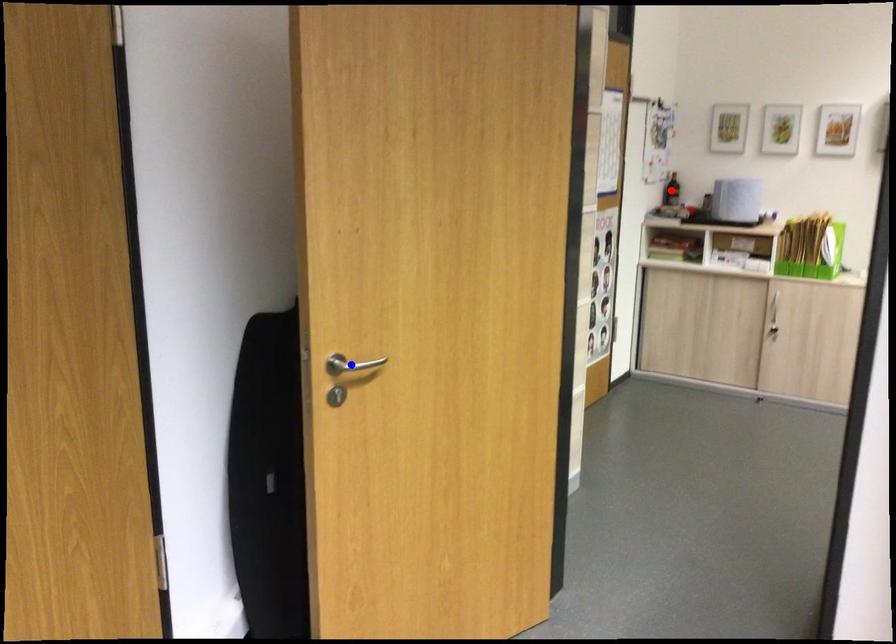
Question: Which of the two points in the image is closer to the camera?

Choices:
 (A) Blue point is closer.
 (B) Red point is closer.

Answer: (A)